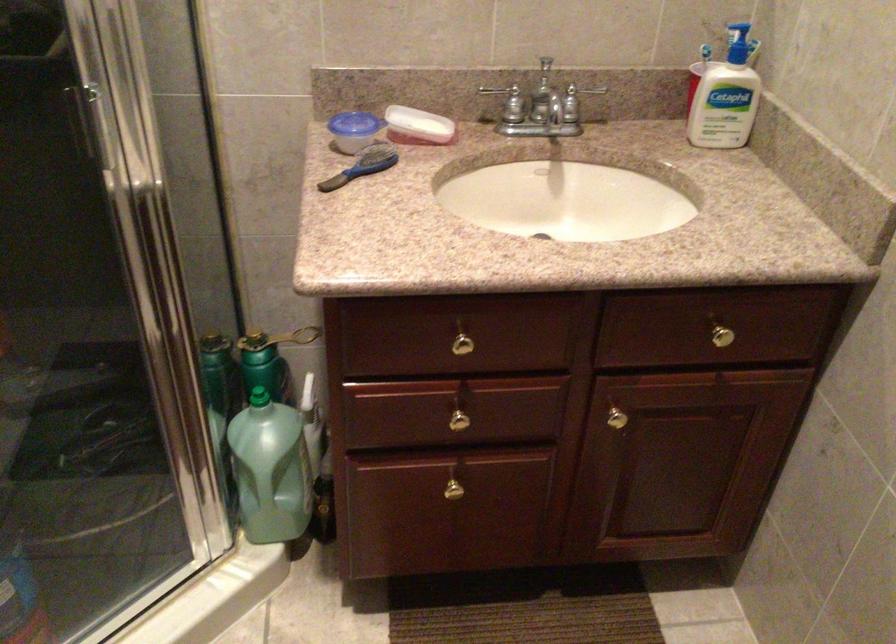
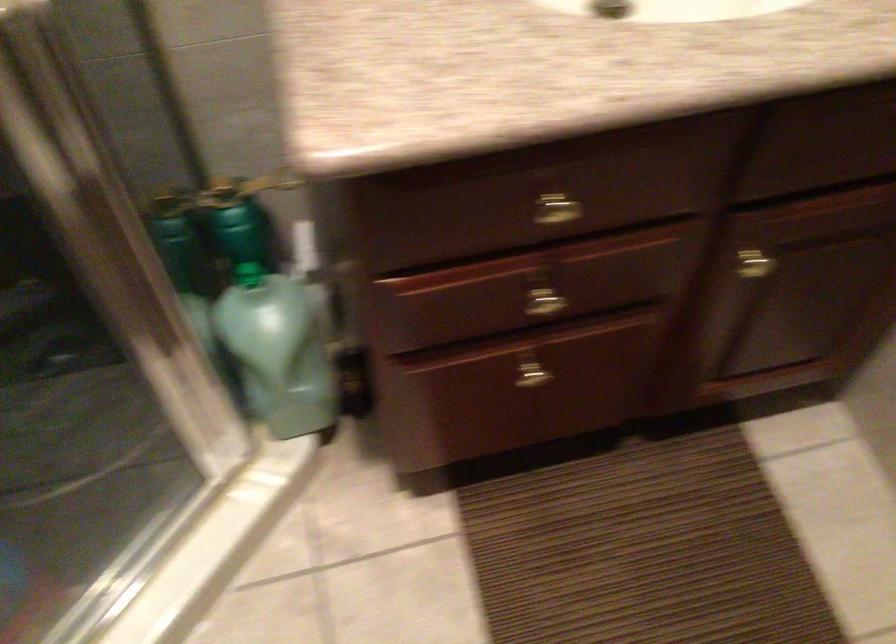
Question: The first image is from the beginning of the video and the second image is from the end. How did the camera likely rotate when shooting the video?

Choices:
 (A) Left
 (B) Right
 (C) Up
 (D) Down

Answer: (D)